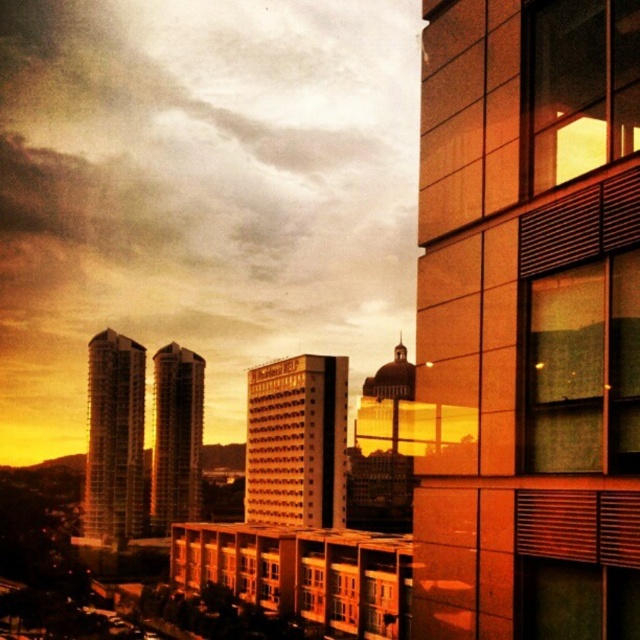
Can you confirm if transparent glass window at right is positioned below matte glass window at upper right?

Indeed, transparent glass window at right is positioned under matte glass window at upper right.

Is point (564, 337) positioned in front of point (552, 45)?

Yes, it is in front of point (552, 45).

The image size is (640, 640). What are the coordinates of `transparent glass window at right` in the screenshot? It's located at (582, 369).